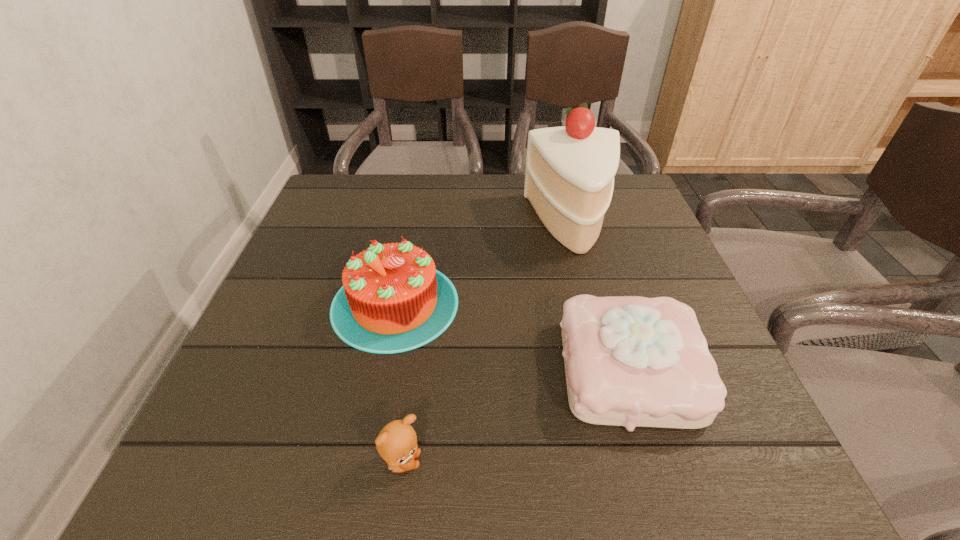
You are a GUI agent. You are given a task and a screenshot of the screen. Output one action in this format:
    pyautogui.click(x=<x>, y=<y>)
    Task: Click on the free space between the shortest cake and the tallest cake
    
    Given the screenshot: What is the action you would take?
    pyautogui.click(x=601, y=296)

At what (x,y) coordinates should I click in order to perform the action: click on vacant space in between the teddy bear and the shortest cake. Please return your answer as a coordinate pair (x, y). This screenshot has height=540, width=960. Looking at the image, I should click on (516, 416).

Where is `the second closest object to the shortest cake`? This screenshot has width=960, height=540. the second closest object to the shortest cake is located at coordinates (569, 180).

Identify the location of object that is the second closest to the shortest cake. Image resolution: width=960 pixels, height=540 pixels. (569, 180).

Where is `cake that is the closest to the second tallest object`? The width and height of the screenshot is (960, 540). cake that is the closest to the second tallest object is located at coordinates (569, 180).

In order to click on the closest cake to the farthest cake in this screenshot , I will do (x=393, y=300).

This screenshot has width=960, height=540. Identify the location of free spot that satisfies the following two spatial constraints: 1. on the front side of the tallest object; 2. on the face of the nearest object. (636, 462).

The width and height of the screenshot is (960, 540). I want to click on vacant space that satisfies the following two spatial constraints: 1. on the front side of the shortest cake; 2. on the left side of the farthest cake, so click(612, 370).

This screenshot has height=540, width=960. Identify the location of vacant space that satisfies the following two spatial constraints: 1. on the front side of the shortest cake; 2. on the face of the teddy bear. (658, 462).

Locate an element on the screen. The width and height of the screenshot is (960, 540). vacant region that satisfies the following two spatial constraints: 1. on the front side of the farthest object; 2. on the left side of the shortest cake is located at coordinates click(612, 370).